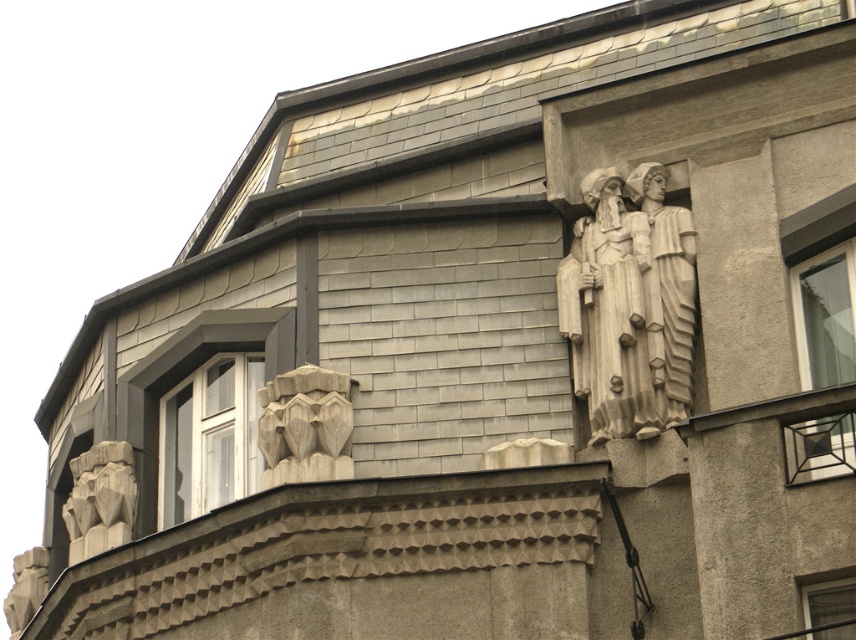
Question: Which object is farther from the camera taking this photo?

Choices:
 (A) transparent glass window at upper right
 (B) white stone sculpture at upper right
 (C) gray stone lion at lower left
 (D) gray stone carving at lower left

Answer: (C)

Question: Among these objects, which one is farthest from the camera?

Choices:
 (A) white stone sculpture at upper right
 (B) gray stone lion at lower left
 (C) transparent glass window at upper right

Answer: (B)

Question: Does white stone sculpture at upper right have a smaller size compared to white glass window at lower left?

Choices:
 (A) no
 (B) yes

Answer: (A)

Question: Which point is closer to the camera?

Choices:
 (A) (821, 616)
 (B) (100, 492)
 (C) (610, 436)

Answer: (A)

Question: Does white glass window at lower left come behind gray stone carving at lower left?

Choices:
 (A) no
 (B) yes

Answer: (A)

Question: Does white stone sculpture at upper right have a lesser width compared to carved stone mask at center?

Choices:
 (A) no
 (B) yes

Answer: (A)